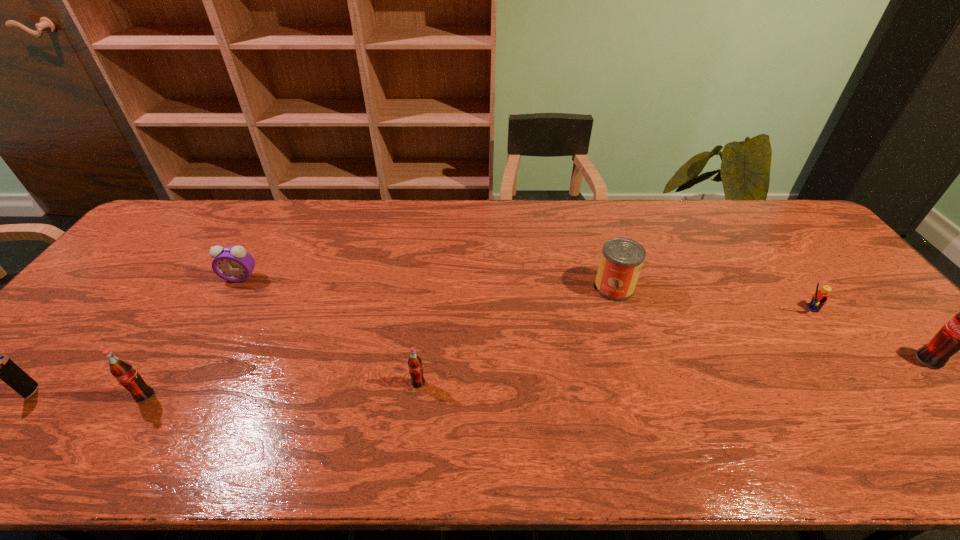
Locate an element on the screen. This screenshot has width=960, height=540. the leftmost soda bottle is located at coordinates (123, 371).

Locate an element on the screen. Image resolution: width=960 pixels, height=540 pixels. the fourth object from left to right is located at coordinates (415, 367).

The image size is (960, 540). I want to click on the shortest soda bottle, so click(415, 367).

Identify the location of the tallest soda bottle. The width and height of the screenshot is (960, 540). (959, 334).

The height and width of the screenshot is (540, 960). In order to click on the tallest object in this screenshot , I will do `click(959, 334)`.

You are a GUI agent. You are given a task and a screenshot of the screen. Output one action in this format:
    pyautogui.click(x=<x>, y=<y>)
    Task: Click on the third farthest object
    The width and height of the screenshot is (960, 540).
    Given the screenshot: What is the action you would take?
    pyautogui.click(x=820, y=297)

The height and width of the screenshot is (540, 960). In order to click on the sixth object from left to right in this screenshot , I will do `click(820, 297)`.

This screenshot has width=960, height=540. I want to click on alarm clock, so click(234, 264).

At what (x,y) coordinates should I click in order to perform the action: click on the leftmost object. Please return your answer as a coordinate pair (x, y). The image size is (960, 540). Looking at the image, I should click on (3, 368).

The width and height of the screenshot is (960, 540). Identify the location of the fifth object from left to right. (621, 261).